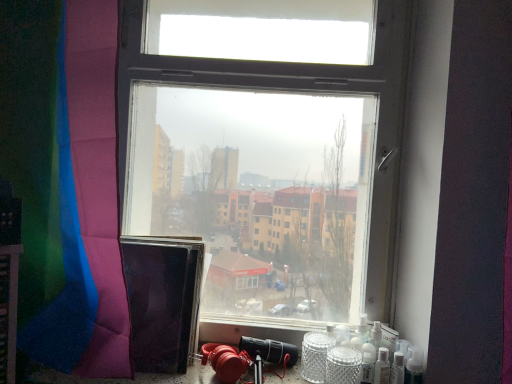
Question: Is shiny polyester curtain at left bigger or smaller than transparent glass window at center?

Choices:
 (A) small
 (B) big

Answer: (A)

Question: Looking at their shapes, would you say shiny polyester curtain at left is wider or thinner than transparent glass window at center?

Choices:
 (A) wide
 (B) thin

Answer: (B)

Question: Based on their relative distances, which object is farther from the transparent glass window at center?

Choices:
 (A) shiny polyester curtain at left
 (B) silver textured glass jar at lower right, which ranks as the 1th glass jar in right-to-left order
 (C) clear glass wine bottle at lower right
 (D) clear glass jar at lower right, the second glass jar in the right-to-left sequence

Answer: (C)

Question: Which object is the farthest from the clear glass jar at lower right, the second glass jar in the right-to-left sequence?

Choices:
 (A) clear glass wine bottle at lower right
 (B) transparent glass window at center
 (C) silver textured glass jar at lower right, which ranks as the 1th glass jar in right-to-left order
 (D) shiny polyester curtain at left

Answer: (D)